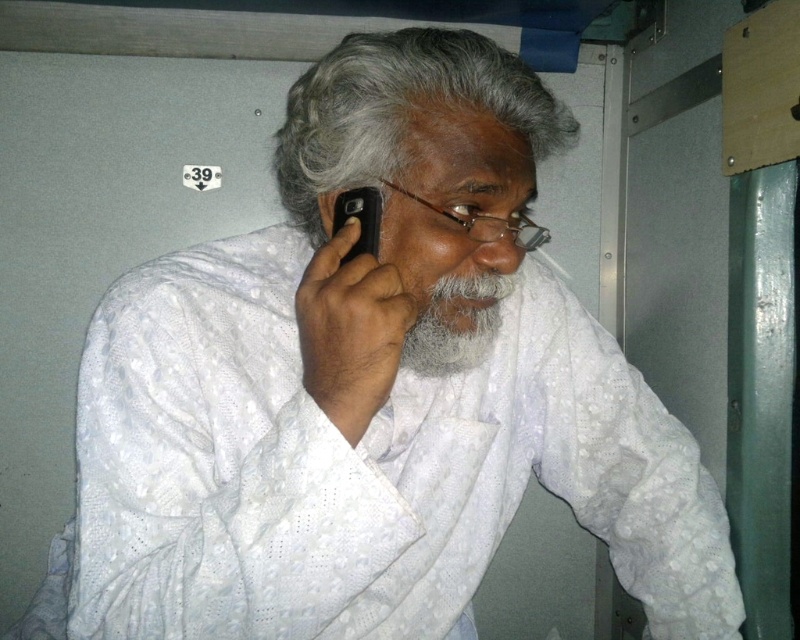
You are a photographer trying to capture a clear shot of the black matte smartphone at upper center and the matte black ear at upper right in the dimly lit train compartment. Which object will appear larger in your photo?

The black matte smartphone at upper center will appear larger in the photo because it is closer to the viewer than the matte black ear at upper right.

You are a photographer who wants to capture a closeup of the gray matte hair at upper center and the black matte smartphone at upper center in the train compartment. Since the smartphone is smaller, which object should you zoom in more to make both appear the same size in the photo?

The gray matte hair at upper center is bigger than the black matte smartphone at upper center. To make both appear the same size in the photo, you should zoom in more on the gray matte hair at upper center so that it fills the frame appropriately while the smartphone remains in view.

Consider the image. You are a passenger on a train and you notice a man in the compartment. He has gray matte hair at upper center and is holding a black matte smartphone at upper center. From your perspective, which object is positioned to the left?

The gray matte hair at upper center is to the left of the black matte smartphone at upper center.